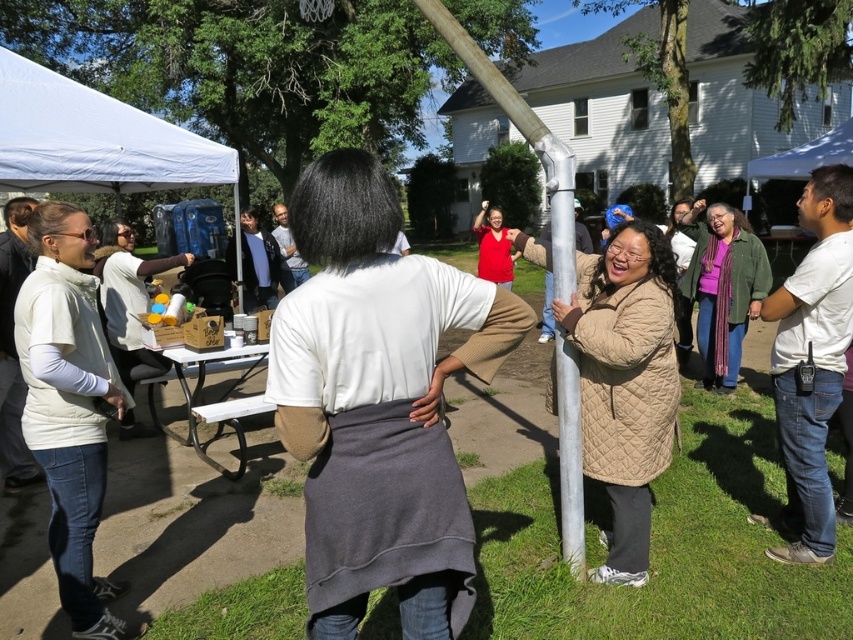
Is silver metallic pole at center further to camera compared to white plastic picnic table at lower left?

No.

Does silver metallic pole at center come in front of white plastic picnic table at lower left?

Yes, it is.

Is point (572, 461) closer to camera compared to point (184, 440)?

Yes, it is.

In order to click on silver metallic pole at center in this screenshot , I will do `click(521, 132)`.

Looking at this image, does quilted beige coat at center have a greater width compared to white plastic picnic table at lower left?

Incorrect, quilted beige coat at center's width does not surpass white plastic picnic table at lower left's.

How distant is quilted beige coat at center from white plastic picnic table at lower left?

The distance of quilted beige coat at center from white plastic picnic table at lower left is 2.38 meters.

Does point (671, 272) come in front of point (241, 442)?

Yes, point (671, 272) is closer to viewer.

You are a GUI agent. You are given a task and a screenshot of the screen. Output one action in this format:
    pyautogui.click(x=<x>, y=<y>)
    Task: Click on the quilted beige coat at center
    This screenshot has width=853, height=640.
    Given the screenshot: What is the action you would take?
    pyautogui.click(x=625, y=381)

Between point (473, 275) and point (693, 282), which one is positioned behind?

The point (693, 282) is more distant.

Who is positioned more to the left, white cotton shirt at center or green quilted jacket at center?

white cotton shirt at center is more to the left.

I want to click on white cotton shirt at center, so click(378, 403).